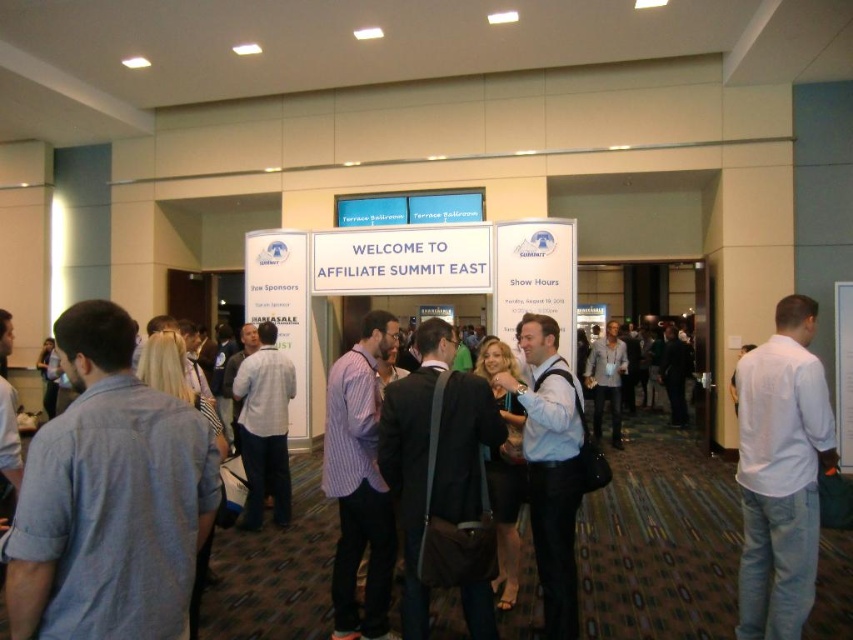
Can you confirm if light blue cotton shirt at left is positioned to the left of white cotton shirt at right?

Indeed, light blue cotton shirt at left is positioned on the left side of white cotton shirt at right.

From the picture: Does light blue cotton shirt at left appear on the right side of white cotton shirt at right?

In fact, light blue cotton shirt at left is to the left of white cotton shirt at right.

Between point (132, 474) and point (778, 506), which one is positioned in front?

Positioned in front is point (132, 474).

Image resolution: width=853 pixels, height=640 pixels. I want to click on light blue cotton shirt at left, so click(x=109, y=497).